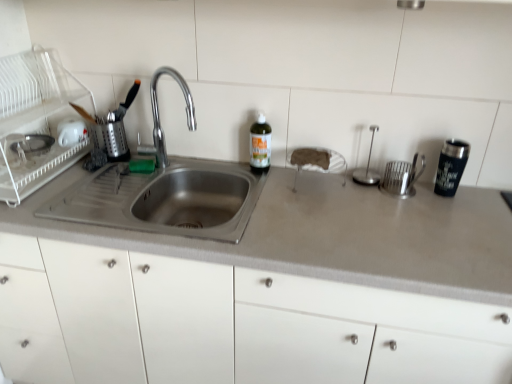
Question: Can you confirm if white matte sponge at center, which is counted as the third appliance, starting from the left, is positioned to the left of black stainless steel tumbler at right?

Choices:
 (A) yes
 (B) no

Answer: (A)

Question: Is white matte sponge at center, which appears as the 3th appliance when viewed from the right, located outside black stainless steel tumbler at right?

Choices:
 (A) no
 (B) yes

Answer: (B)

Question: Considering the relative sizes of white matte sponge at center, which is counted as the third appliance, starting from the left, and black stainless steel tumbler at right in the image provided, is white matte sponge at center, which is counted as the third appliance, starting from the left, bigger than black stainless steel tumbler at right?

Choices:
 (A) yes
 (B) no

Answer: (A)

Question: From the image's perspective, is white matte sponge at center, which is counted as the third appliance, starting from the left, below black stainless steel tumbler at right?

Choices:
 (A) no
 (B) yes

Answer: (A)

Question: Is white matte sponge at center, which appears as the 3th appliance when viewed from the right, positioned with its back to black stainless steel tumbler at right?

Choices:
 (A) no
 (B) yes

Answer: (A)

Question: Considering the positions of black stainless steel tumbler at right and stainless steel sink at left in the image, is black stainless steel tumbler at right taller or shorter than stainless steel sink at left?

Choices:
 (A) short
 (B) tall

Answer: (A)

Question: In terms of width, does black stainless steel tumbler at right look wider or thinner when compared to stainless steel sink at left?

Choices:
 (A) thin
 (B) wide

Answer: (A)

Question: From the image's perspective, is black stainless steel tumbler at right located above or below stainless steel sink at left?

Choices:
 (A) above
 (B) below

Answer: (B)

Question: Is point (452, 142) closer or farther from the camera than point (238, 200)?

Choices:
 (A) farther
 (B) closer

Answer: (B)

Question: Looking at their shapes, would you say green glass bottle at center is wider or thinner than polished stainless steel spoon holder at right, which is counted as the 4th appliance, starting from the left?

Choices:
 (A) thin
 (B) wide

Answer: (A)

Question: From a real-world perspective, is green glass bottle at center above or below polished stainless steel spoon holder at right, positioned as the second appliance in right-to-left order?

Choices:
 (A) below
 (B) above

Answer: (A)

Question: In the image, is green glass bottle at center positioned in front of or behind polished stainless steel spoon holder at right, which is counted as the 4th appliance, starting from the left?

Choices:
 (A) front
 (B) behind

Answer: (B)

Question: In terms of height, does green glass bottle at center look taller or shorter compared to polished stainless steel spoon holder at right, positioned as the second appliance in right-to-left order?

Choices:
 (A) short
 (B) tall

Answer: (A)

Question: In terms of width, does white plastic dish rack at left, the 1th appliance from the left, look wider or thinner when compared to white glossy mug at upper left, placed as the 4th appliance when sorted from right to left?

Choices:
 (A) wide
 (B) thin

Answer: (A)

Question: In the image, is white plastic dish rack at left, positioned as the 5th appliance in right-to-left order, positioned in front of or behind white glossy mug at upper left, the 2th appliance viewed from the left?

Choices:
 (A) behind
 (B) front

Answer: (B)